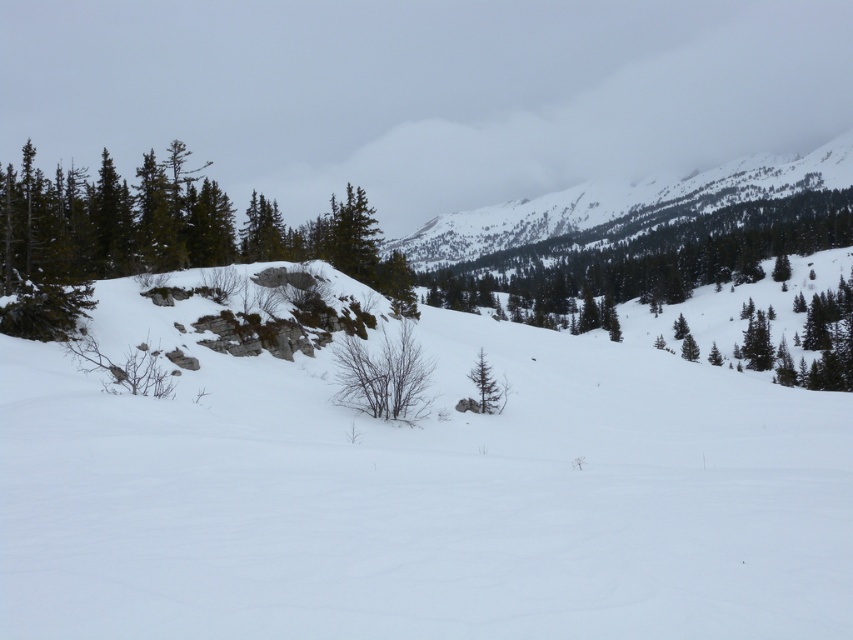
Question: Is the position of white powdery snow at center more distant than that of green matte tree at center?

Choices:
 (A) yes
 (B) no

Answer: (B)

Question: Which object is the closest to the green textured tree at center?

Choices:
 (A) white powdery snow at center
 (B) green matte tree at center

Answer: (A)

Question: Which point appears closest to the camera in this image?

Choices:
 (A) (9, 545)
 (B) (480, 384)

Answer: (A)

Question: From the image, what is the correct spatial relationship of green textured tree at center in relation to green matte tree at center?

Choices:
 (A) above
 (B) below

Answer: (A)

Question: Which of these objects is positioned farthest from the green matte tree at center?

Choices:
 (A) white powdery snow at center
 (B) green textured tree at center

Answer: (B)

Question: Observing the image, what is the correct spatial positioning of white powdery snow at center in reference to green matte tree at center?

Choices:
 (A) above
 (B) below

Answer: (A)